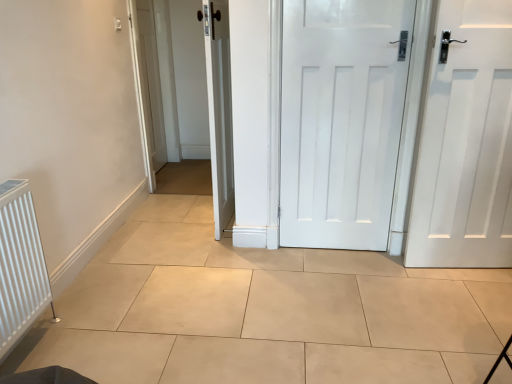
The height and width of the screenshot is (384, 512). I want to click on vacant space to the right of white ribbed radiator at left, so click(87, 348).